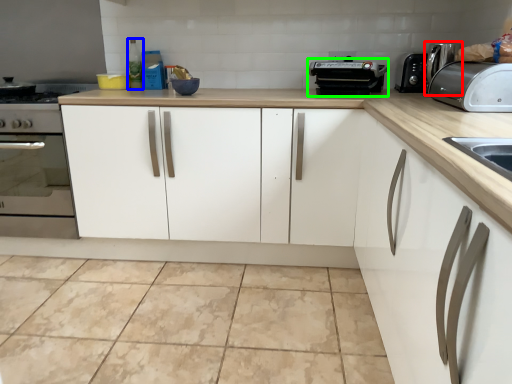
Question: Estimate the real-world distances between objects in this image. Which object is closer to coffee machine (highlighted by a red box), bottle (highlighted by a blue box) or appliance (highlighted by a green box)?

Choices:
 (A) bottle
 (B) appliance

Answer: (B)